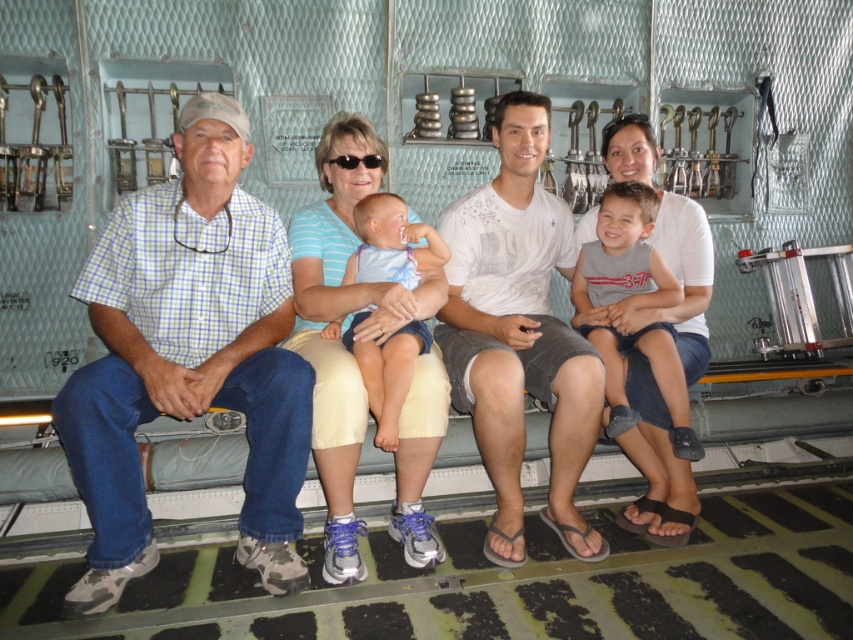
You are standing in the aircraft cargo hold and see two points marked in the scene. The first point is at coordinates point (184, 118) and the second is at point (355, 388). Which point is closer to you?

Point (184, 118) is closer to you because it is further to the viewer than point (355, 388).

From the picture: You are standing in the aircraft cargo hold and want to move from point A to point B. Point A is at coordinates point (164, 376) and point B is at coordinates point (363, 260). Which point is closer to you when you start moving?

Point (164, 376) is closer to the viewer than point (363, 260), so you will start closer to point A.